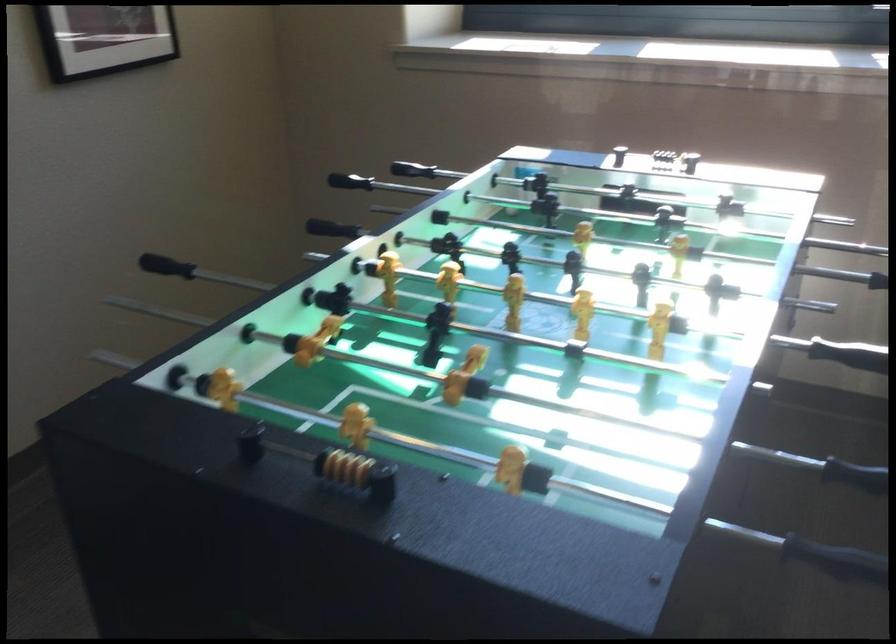
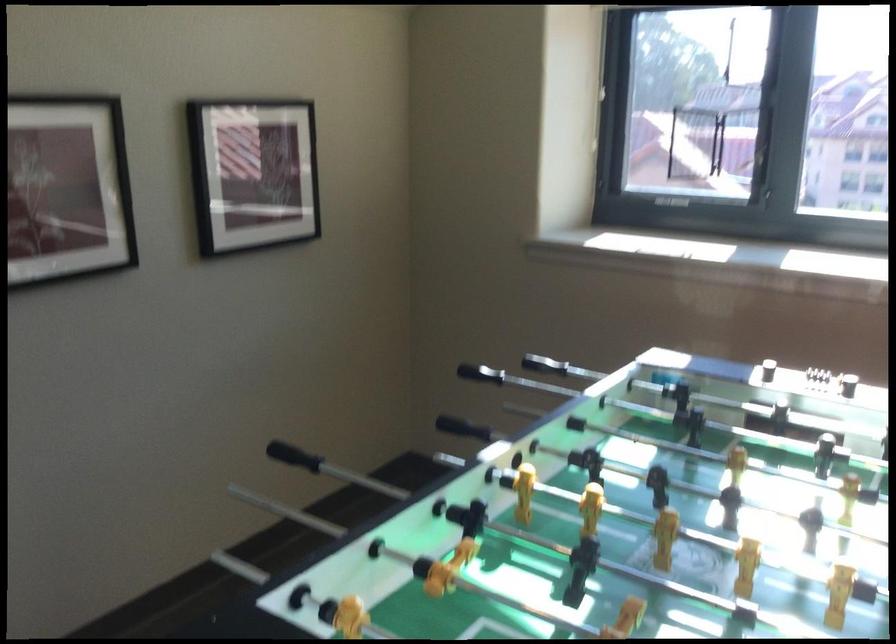
Where in the second image is the point corresponding to the point at 418,175 from the first image?

(544, 365)